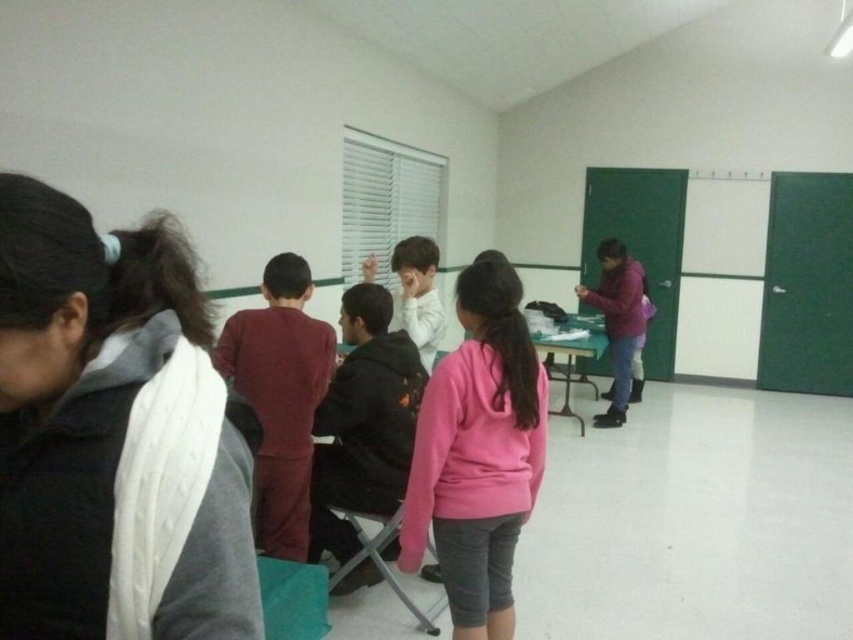
You are standing in the classroom and want to reach the point at coordinates point (231, 513). If your arm can extend 30 inches, can you reach it?

The point (231, 513) is 31.38 inches from the viewer, so your arm cannot reach it since it extends only 30 inches.

You are a participant in the activity and need to place a book on the table. Which object, the white knitted scarf at left or the pink fleece sweatshirt at center, should you choose to place the book on top of to ensure it is more visible to everyone in the room?

The pink fleece sweatshirt at center is taller than the white knitted scarf at left, so placing the book on top of the pink fleece sweatshirt at center would make it more visible to everyone in the room.